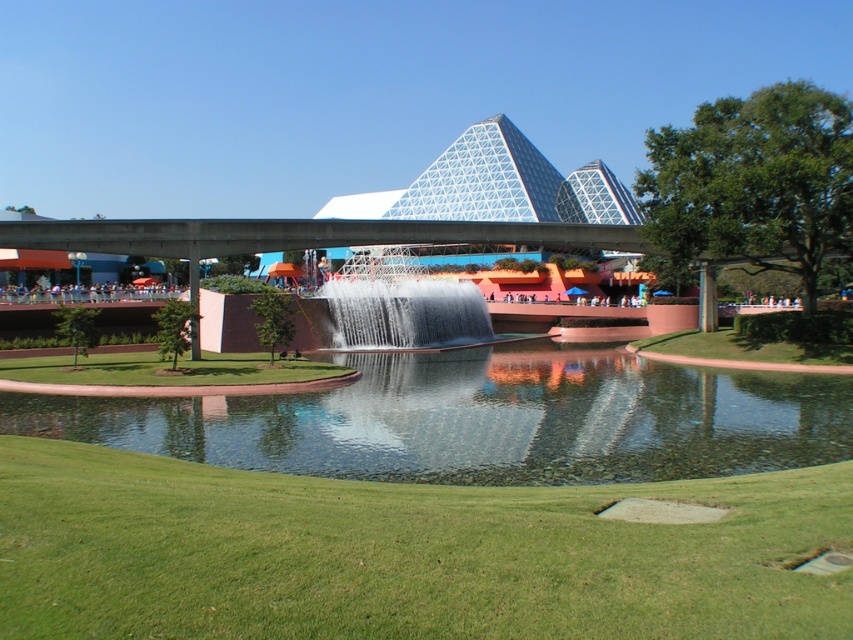
Question: Does green grassy golf course at lower center have a larger size compared to clear glass waterfall at center?

Choices:
 (A) no
 (B) yes

Answer: (A)

Question: Is green grassy golf course at lower center above clear glass waterfall at center?

Choices:
 (A) yes
 (B) no

Answer: (B)

Question: Is clear glass lake at center to the right of clear glass waterfall at center from the viewer's perspective?

Choices:
 (A) no
 (B) yes

Answer: (B)

Question: Which point appears farthest from the camera in this image?

Choices:
 (A) (323, 324)
 (B) (412, 458)
 (C) (291, 600)

Answer: (A)

Question: Which object is positioned closest to the clear glass lake at center?

Choices:
 (A) clear glass waterfall at center
 (B) green grassy golf course at lower center

Answer: (B)

Question: Among these objects, which one is nearest to the camera?

Choices:
 (A) clear glass lake at center
 (B) clear glass waterfall at center
 (C) green grassy golf course at lower center

Answer: (C)